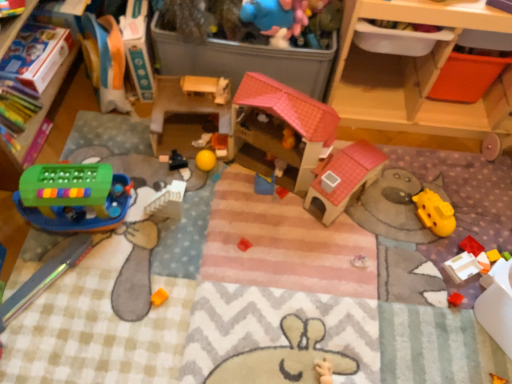
Where is `free point to the left of white plastic block at lower right, acting as the eighth toy starting from the left`? The height and width of the screenshot is (384, 512). free point to the left of white plastic block at lower right, acting as the eighth toy starting from the left is located at coordinates (409, 267).